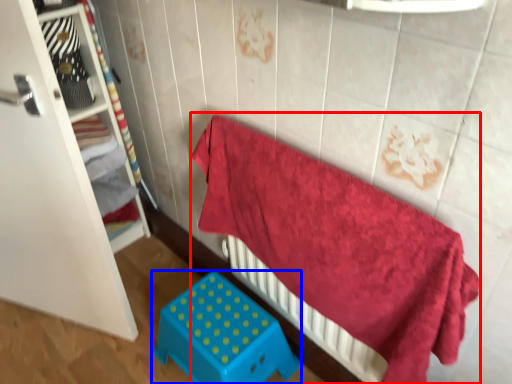
Question: Which object appears closest to the camera in this image, bed (highlighted by a red box) or furniture (highlighted by a blue box)?

Choices:
 (A) bed
 (B) furniture

Answer: (A)